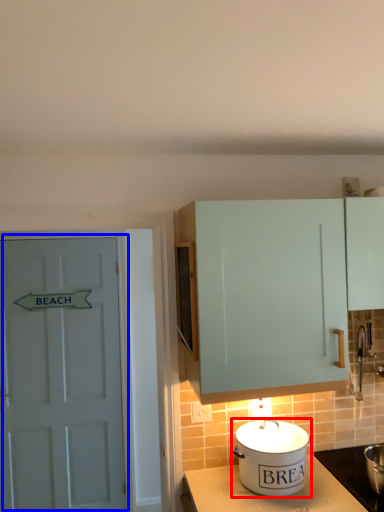
Question: Which object appears closest to the camera in this image, kitchen appliance (highlighted by a red box) or door (highlighted by a blue box)?

Choices:
 (A) kitchen appliance
 (B) door

Answer: (A)